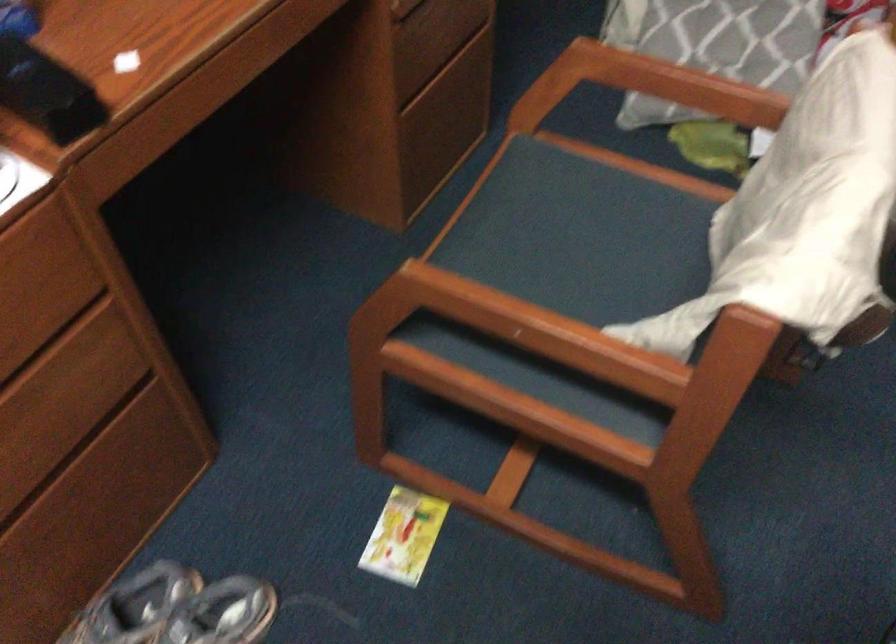
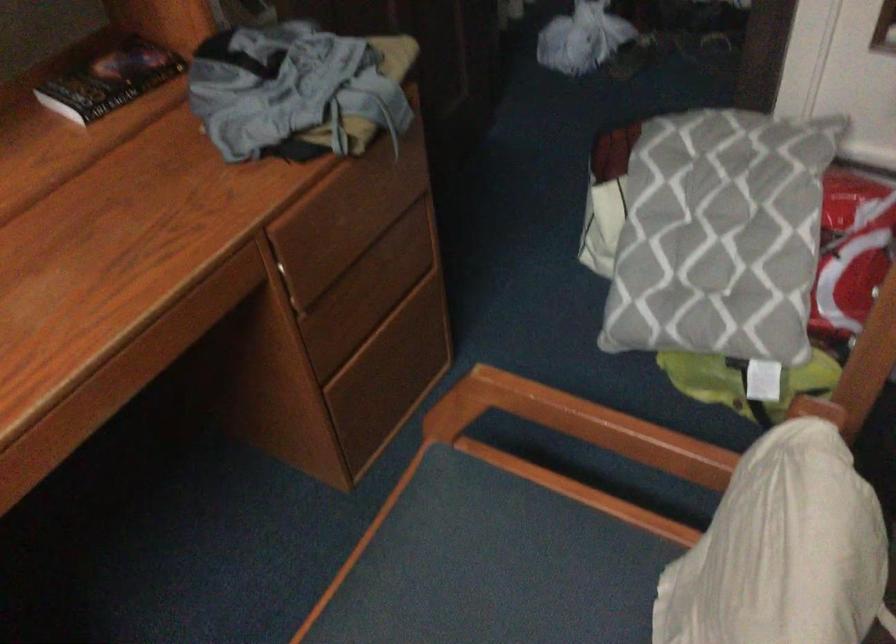
Where in the second image is the point corresponding to point (622, 222) from the first image?

(549, 580)